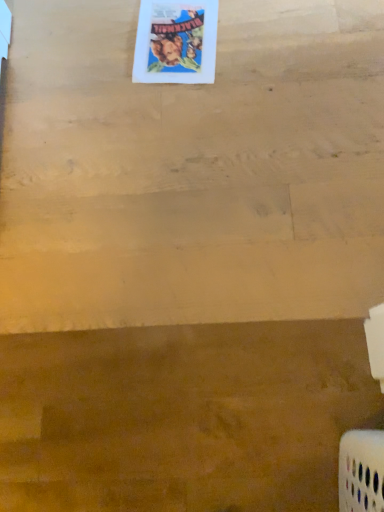
The width and height of the screenshot is (384, 512). What are the coordinates of `free space to the right of matte paper comic book at upper center` in the screenshot? It's located at (265, 35).